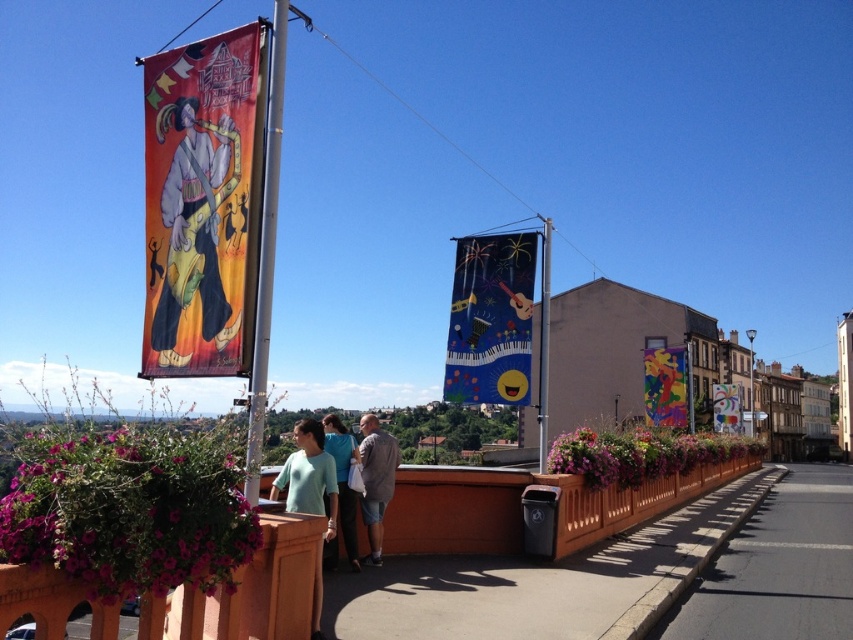
Question: Can you confirm if metallic pole at upper left is positioned to the right of metallic pole at center?

Choices:
 (A) yes
 (B) no

Answer: (B)

Question: Can you confirm if light blue cotton shirt at center is positioned to the left of gray cotton shirt at center?

Choices:
 (A) yes
 (B) no

Answer: (B)

Question: Can you confirm if brown wooden pavement at lower right is smaller than blue fabric poster at center?

Choices:
 (A) yes
 (B) no

Answer: (B)

Question: Among these objects, which one is farthest from the camera?

Choices:
 (A) brown wooden pavement at lower right
 (B) metallic pole at upper left

Answer: (A)

Question: Which point is farther to the camera?

Choices:
 (A) click(259, 266)
 (B) click(372, 561)

Answer: (B)

Question: Which is nearer to the metallic pole at center?

Choices:
 (A) blue fabric poster at center
 (B) metallic pole at upper left
 (C) brown wooden pavement at lower right
 (D) gray cotton shirt at center

Answer: (D)